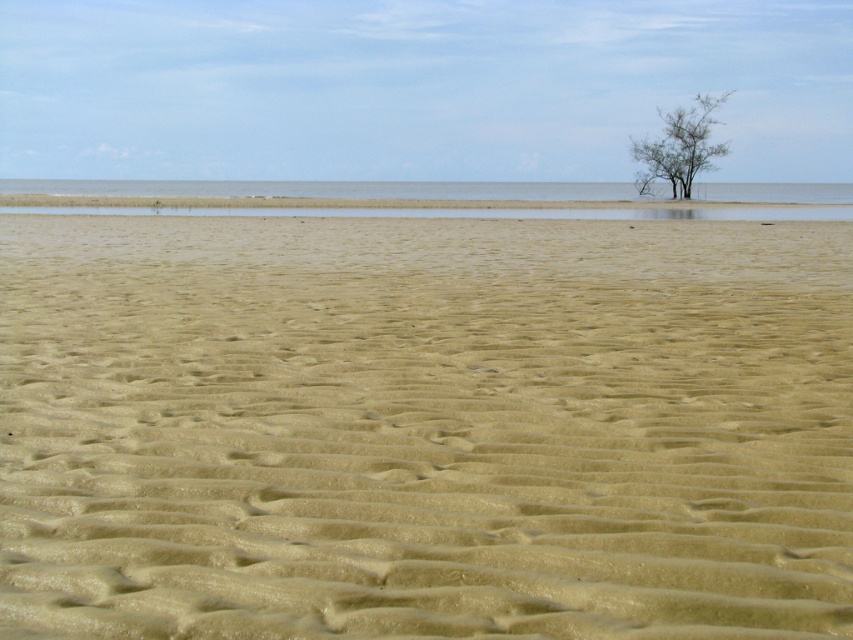
This screenshot has width=853, height=640. What are the coordinates of `smooth sand at center` in the screenshot? It's located at (422, 428).

Between point (103, 385) and point (672, 170), which one is positioned behind?

Positioned behind is point (672, 170).

Find the location of a particular element. smooth sand at center is located at coordinates (422, 428).

Which of these two, clear water at center or green leafy tree at upper right, stands shorter?

clear water at center is shorter.

Does clear water at center appear on the right side of green leafy tree at upper right?

No, clear water at center is not to the right of green leafy tree at upper right.

Is point (694, 196) behind point (695, 157)?

No, (694, 196) is closer to viewer.

The height and width of the screenshot is (640, 853). I want to click on clear water at center, so click(427, 198).

Does smooth sand at center come behind clear water at center?

No, smooth sand at center is in front of clear water at center.

Looking at this image, can you confirm if smooth sand at center is positioned above clear water at center?

Incorrect, smooth sand at center is not positioned above clear water at center.

Who is more distant from viewer, (390, 356) or (132, 200)?

Positioned behind is point (132, 200).

The width and height of the screenshot is (853, 640). What are the coordinates of `smooth sand at center` in the screenshot? It's located at (422, 428).